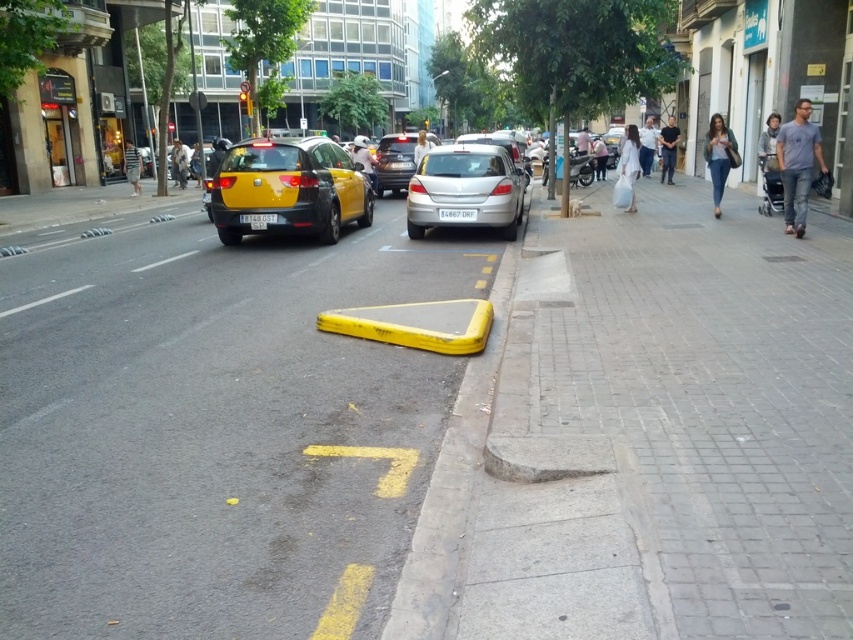
Question: Which of these objects is positioned closest to the matte black scooter at center?

Choices:
 (A) shiny silver sedan at center
 (B) yellow rubber curb at lower center
 (C) light blue jeans at center

Answer: (A)

Question: Which is nearer to the black cotton shirt at center?

Choices:
 (A) gray concrete sidewalk at right
 (B) light beige jacket at center
 (C) denim jeans at right

Answer: (C)

Question: Where is gray fabric stroller at right located in relation to white cotton dress at center in the image?

Choices:
 (A) right
 (B) left

Answer: (A)

Question: Can you confirm if gray concrete sidewalk at right is smaller than white cotton dress at center?

Choices:
 (A) no
 (B) yes

Answer: (A)

Question: Does white cotton dress at center have a greater width compared to matte black scooter at center?

Choices:
 (A) yes
 (B) no

Answer: (B)

Question: Among these objects, which one is nearest to the camera?

Choices:
 (A) light brown leather jacket at upper center
 (B) denim jeans at right

Answer: (B)